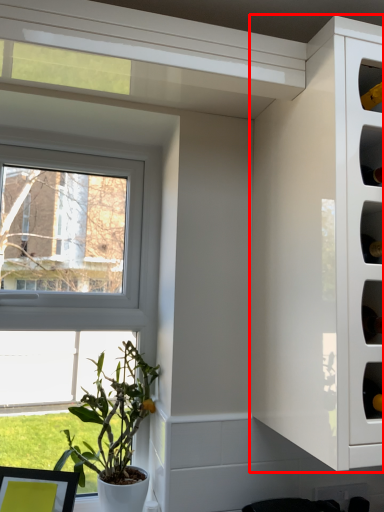
Question: From the image's perspective, what is the correct spatial relationship of cabinetry (annotated by the red box) in relation to houseplant?

Choices:
 (A) below
 (B) above

Answer: (B)